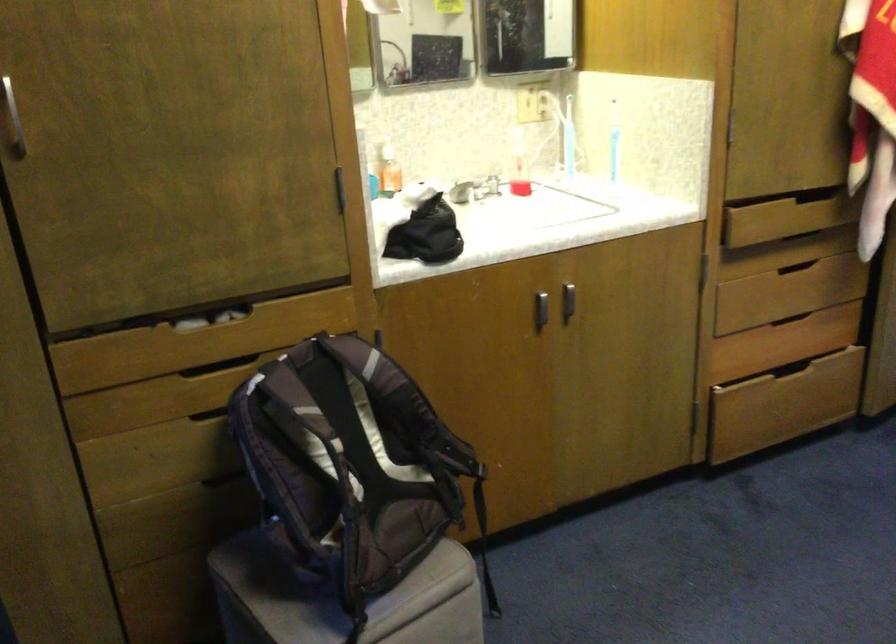
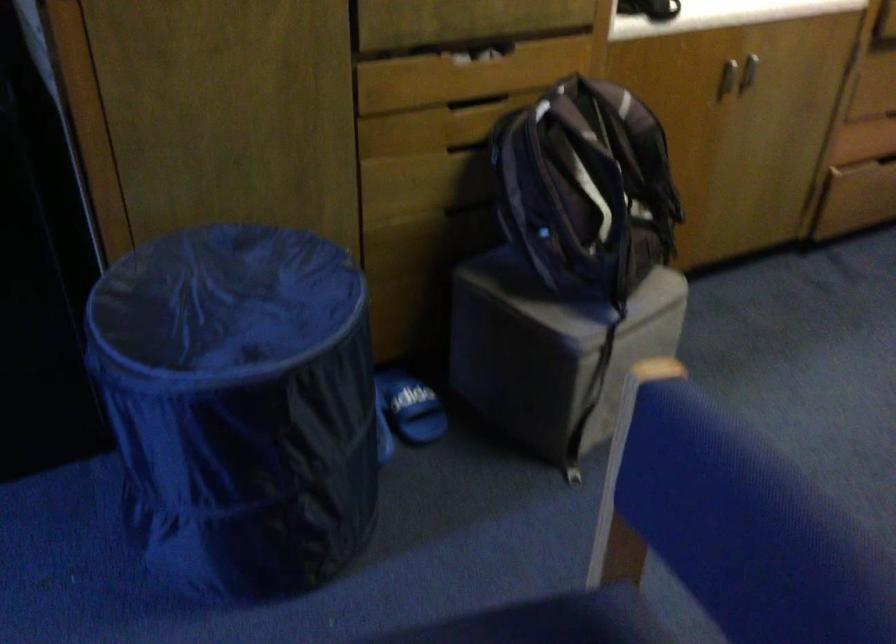
Locate, in the second image, the point that corresponds to [566,308] in the first image.

(748, 71)